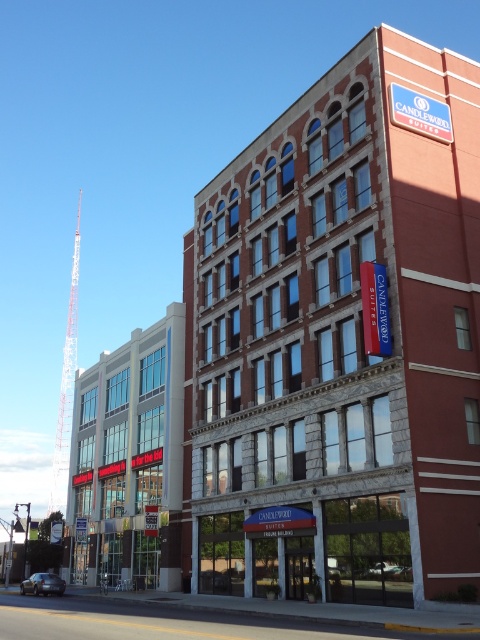
Question: Which of the following is the farthest from the observer?

Choices:
 (A) (286, 342)
 (B) (183, 368)

Answer: (B)

Question: Does red brick building at center have a larger size compared to glass storefront at left?

Choices:
 (A) no
 (B) yes

Answer: (B)

Question: Which of the following is the farthest from the observer?

Choices:
 (A) glass storefront at left
 (B) red brick building at center

Answer: (A)

Question: Does red brick building at center come in front of glass storefront at left?

Choices:
 (A) no
 (B) yes

Answer: (B)

Question: Is red brick building at center closer to camera compared to glass storefront at left?

Choices:
 (A) yes
 (B) no

Answer: (A)